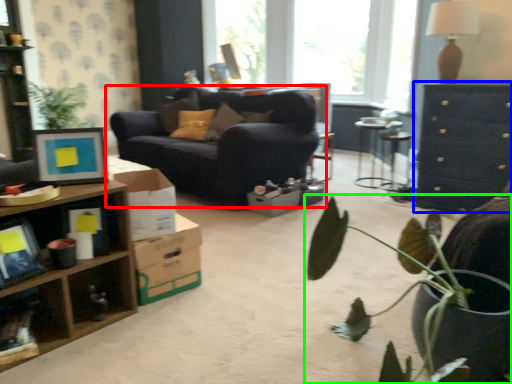
Question: Which object is the farthest from studio couch (highlighted by a red box)? Choose among these: cabinetry (highlighted by a blue box) or houseplant (highlighted by a green box).

Choices:
 (A) cabinetry
 (B) houseplant

Answer: (B)